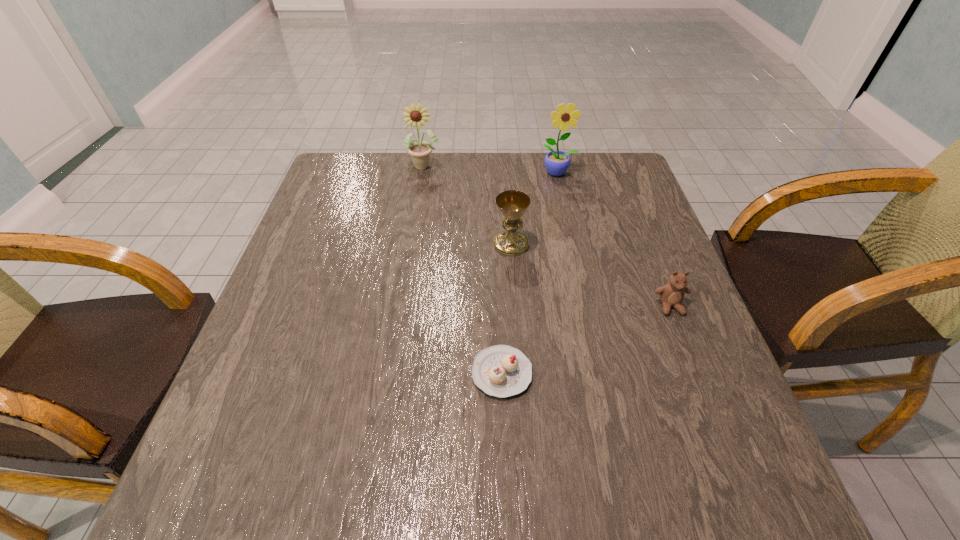
The width and height of the screenshot is (960, 540). Find the location of `free space located 0.100m on the front of the chalice`. free space located 0.100m on the front of the chalice is located at coordinates (515, 287).

The width and height of the screenshot is (960, 540). What are the coordinates of `vacant space situated 0.300m on the front-facing side of the fourth tallest object` in the screenshot? It's located at (731, 460).

I want to click on free space located on the back of the shortest object, so click(x=497, y=264).

I want to click on object present at the right edge, so click(671, 294).

In order to click on free space at the far edge in this screenshot , I will do `click(579, 172)`.

You are a GUI agent. You are given a task and a screenshot of the screen. Output one action in this format:
    pyautogui.click(x=<x>, y=<y>)
    Task: Click on the vacant region at the near edge of the desktop
    The image size is (960, 540).
    Given the screenshot: What is the action you would take?
    pyautogui.click(x=645, y=489)

Find the location of a particular element. The height and width of the screenshot is (540, 960). free space at the left edge of the desktop is located at coordinates (271, 300).

Image resolution: width=960 pixels, height=540 pixels. I want to click on vacant area at the right edge of the desktop, so click(x=652, y=312).

The image size is (960, 540). Find the location of `vacant space at the far left corner of the desktop`. vacant space at the far left corner of the desktop is located at coordinates (321, 194).

The height and width of the screenshot is (540, 960). In the image, there is a desktop. Identify the location of vacant region at the near left corner. (214, 485).